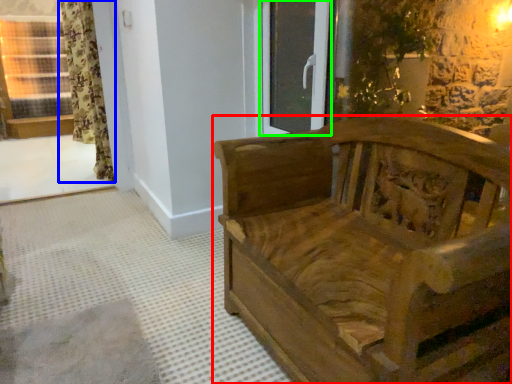
Question: Based on their relative distances, which object is farther from furniture (highlighted by a red box)? Choose from curtain (highlighted by a blue box) and glass door (highlighted by a green box).

Choices:
 (A) curtain
 (B) glass door

Answer: (A)